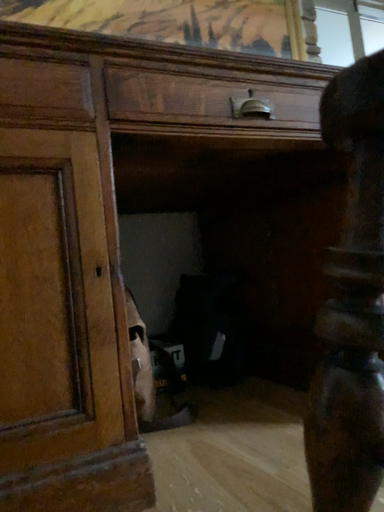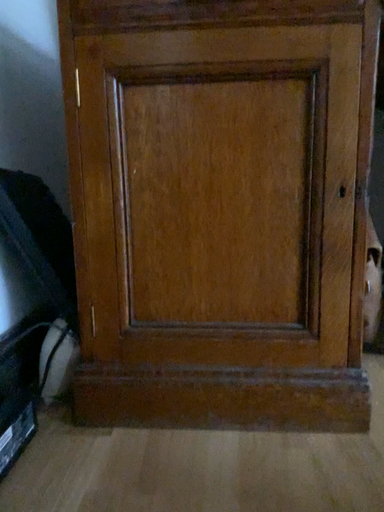
Question: Which way did the camera rotate in the video?

Choices:
 (A) rotated upward
 (B) rotated downward

Answer: (B)